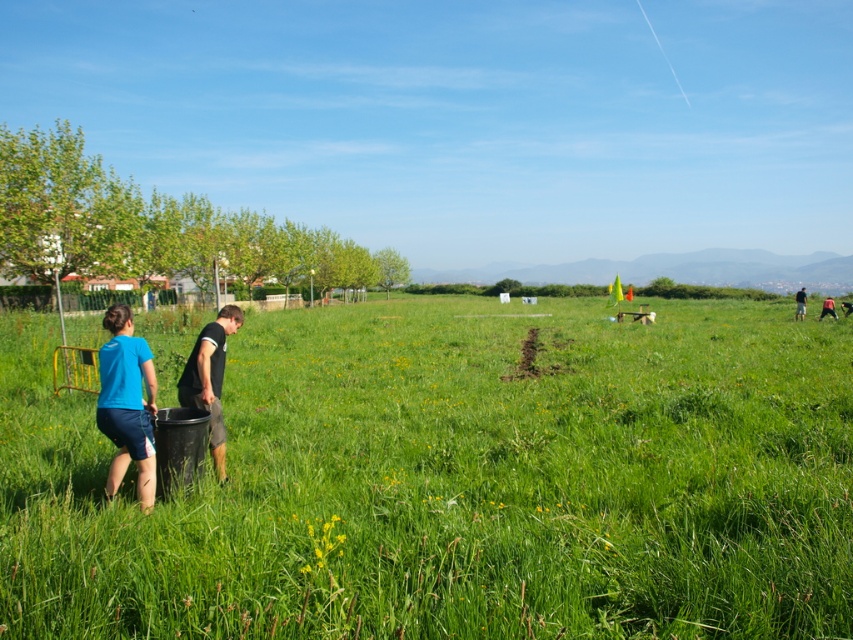
You are planning to set up a picnic in the green grass pasture at center and want to place a picnic basket next to the blue matte shirt at lower left. Given the spatial relationship between them, will the picnic basket fit comfortably between the two without overlapping?

The green grass pasture at center is wider than the blue matte shirt at lower left, so placing the picnic basket between them should be possible without overlapping, as there is sufficient space.

You are standing at the origin point of the image. Which object is located at coordinates point (126, 404)?

The point (126, 404) corresponds to the blue fabric couple at center.

You are a photographer trying to capture a group photo of the blue fabric couple at center and the blurred green shirt at right. Since you want everyone to be in focus, you need to know which subject is closer to you. Based on the scene, which one is nearer?

The blue fabric couple at center is closer to you because their width is smaller than the blurred green shirt at right, indicating they are nearer in the scene.